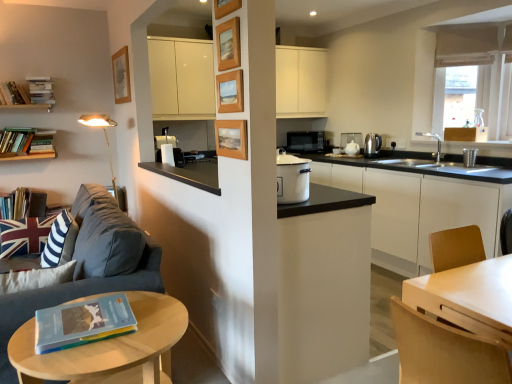
The width and height of the screenshot is (512, 384). Find the location of `vacant region above hardcover book at lower left, the first book when ordered from front to back (from a real-world perspective)`. vacant region above hardcover book at lower left, the first book when ordered from front to back (from a real-world perspective) is located at coordinates (88, 309).